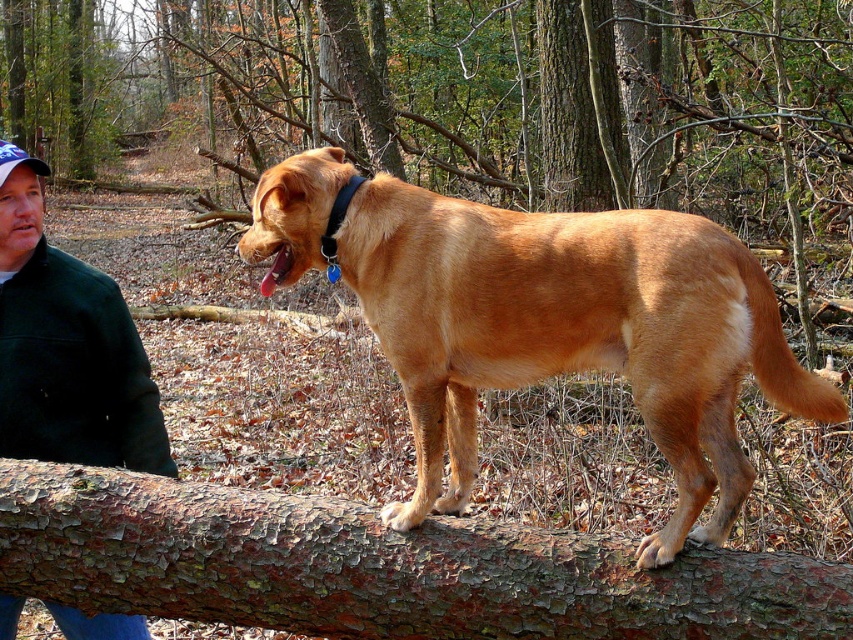
Question: Among these objects, which one is nearest to the camera?

Choices:
 (A) green fleece jacket at left
 (B) blue fabric cap at upper left
 (C) golden fur dog at center
 (D) brown rough bark at center

Answer: (B)

Question: In this image, where is brown rough bark at center located relative to green fleece jacket at left?

Choices:
 (A) left
 (B) right

Answer: (B)

Question: Considering the real-world distances, which object is closest to the green fleece jacket at left?

Choices:
 (A) golden fur dog at center
 (B) black leather collar at upper center
 (C) brown rough bark tree trunk at center

Answer: (B)

Question: Which is farther from the black leather collar at upper center?

Choices:
 (A) green fleece jacket at left
 (B) blue fabric cap at upper left

Answer: (B)

Question: Can you confirm if golden fur dog at center is positioned above brown rough bark at center?

Choices:
 (A) yes
 (B) no

Answer: (A)

Question: Can you confirm if golden fur dog at center is positioned to the left of blue fabric cap at upper left?

Choices:
 (A) no
 (B) yes

Answer: (A)